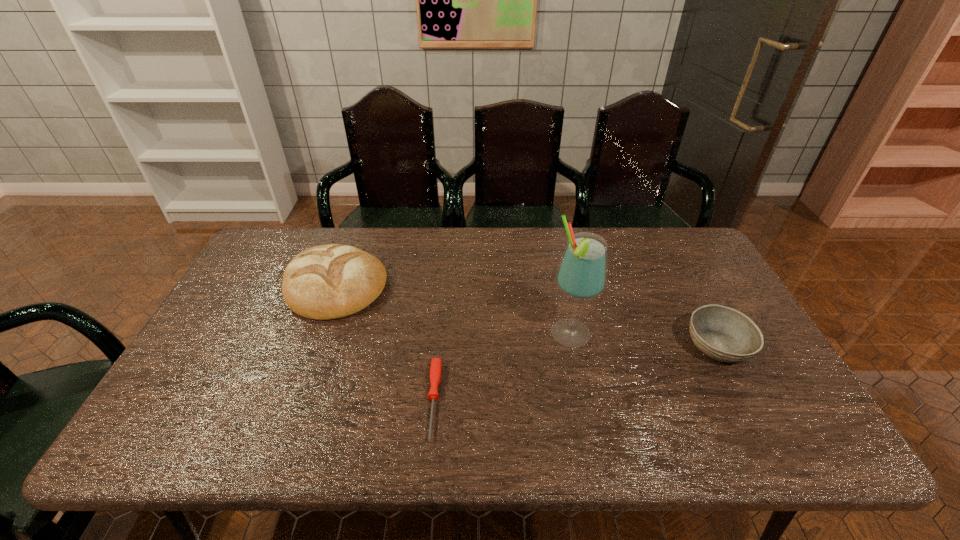
Image resolution: width=960 pixels, height=540 pixels. Find the location of `free space between the third shortest object and the shortest object`. free space between the third shortest object and the shortest object is located at coordinates (385, 343).

This screenshot has width=960, height=540. What are the coordinates of `the third closest object to the leftmost object` in the screenshot? It's located at (724, 334).

Select which object appears as the third closest to the third object from right to left. Please provide its 2D coordinates. Your answer should be formatted as a tuple, i.e. [(x, y)], where the tuple contains the x and y coordinates of a point satisfying the conditions above.

[(724, 334)]

You are a GUI agent. You are given a task and a screenshot of the screen. Output one action in this format:
    pyautogui.click(x=<x>, y=<y>)
    Task: Click on the vacant space that satisfies the following two spatial constraints: 1. on the front side of the bread; 2. on the right side of the bowl
    Image resolution: width=960 pixels, height=540 pixels.
    Given the screenshot: What is the action you would take?
    pyautogui.click(x=313, y=346)

Where is `free point that satisfies the following two spatial constraints: 1. on the front side of the third object from left to right; 2. on the left side of the bowl`? This screenshot has width=960, height=540. free point that satisfies the following two spatial constraints: 1. on the front side of the third object from left to right; 2. on the left side of the bowl is located at coordinates (572, 346).

The image size is (960, 540). What are the coordinates of `vacant area in the image that satisfies the following two spatial constraints: 1. on the front side of the third shortest object; 2. on the right side of the bowl` in the screenshot? It's located at (313, 346).